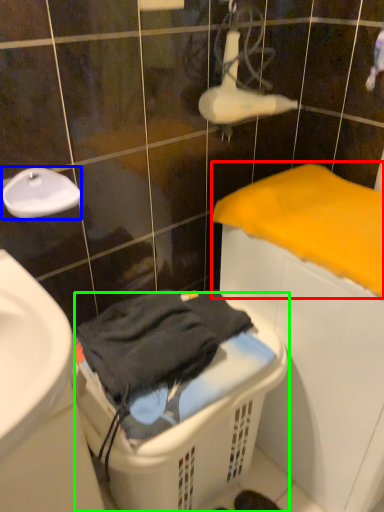
Question: Based on their relative distances, which object is farther from bath towel (highlighted by a red box)? Choose from faucet (highlighted by a blue box) and laundry basket (highlighted by a green box).

Choices:
 (A) faucet
 (B) laundry basket

Answer: (A)